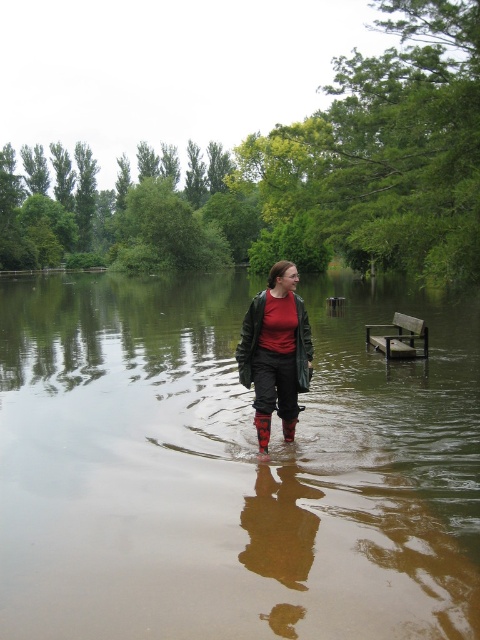
Question: From the image, what is the correct spatial relationship of red rubber rain boot at center in relation to rubber matte rain boot at center?

Choices:
 (A) right
 (B) left

Answer: (B)

Question: Among these objects, which one is farthest from the camera?

Choices:
 (A) rubber matte rain boot at center
 (B) wooden bench at lower right

Answer: (B)

Question: Is brown matte water at center to the right of rubber matte rain boot at center from the viewer's perspective?

Choices:
 (A) yes
 (B) no

Answer: (B)

Question: Which object is the closest to the red rubber rain boot at center?

Choices:
 (A) matte black jacket at center
 (B) rubber matte rain boot at center
 (C) brown matte water at center
 (D) wooden bench at lower right

Answer: (A)

Question: Among these objects, which one is nearest to the camera?

Choices:
 (A) red rubber rain boot at center
 (B) brown matte water at center

Answer: (B)

Question: Is matte black jacket at center smaller than wooden bench at lower right?

Choices:
 (A) yes
 (B) no

Answer: (A)